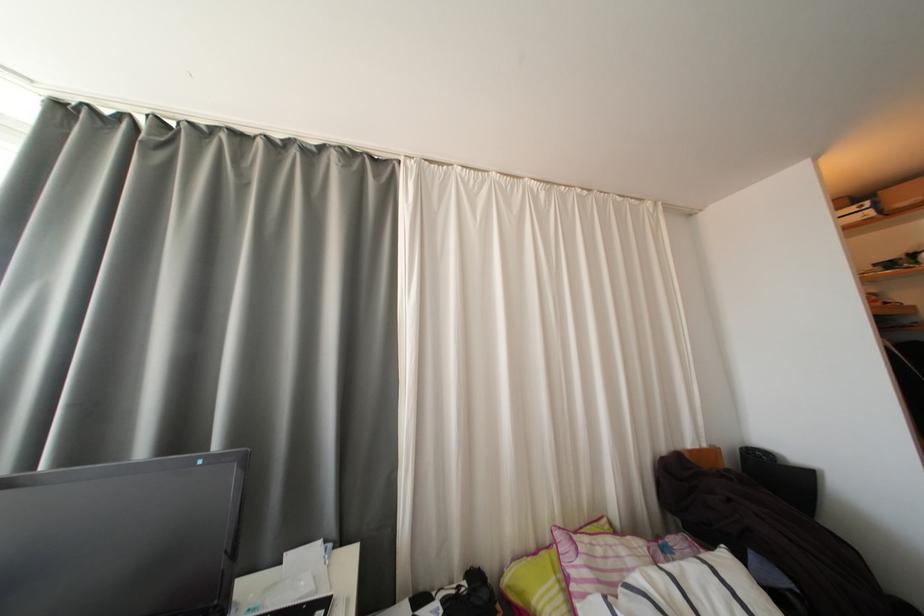
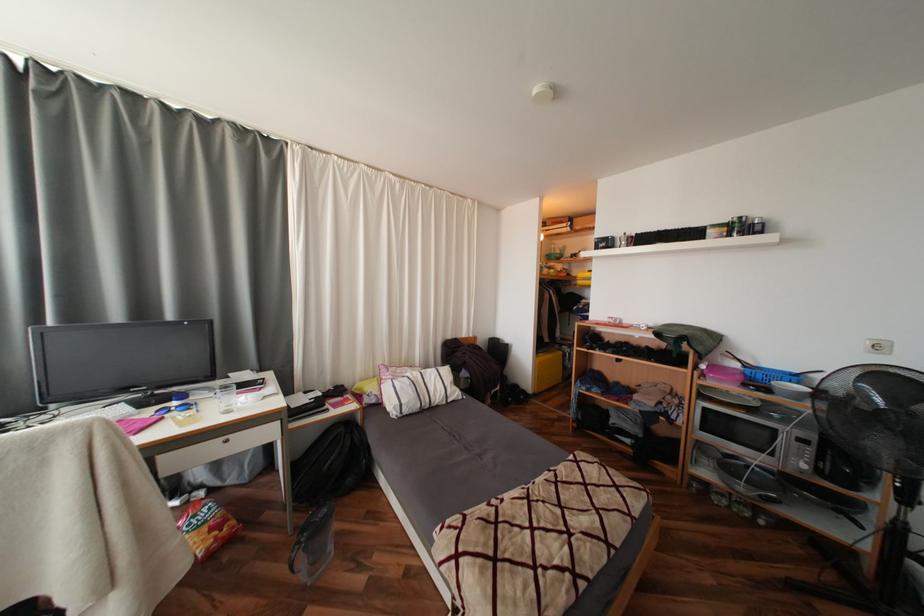
Question: Which direction would the cameraman need to move to produce the second image? Reply with the corresponding letter.

Choices:
 (A) Left
 (B) Right
 (C) Forward
 (D) Backward

Answer: (D)